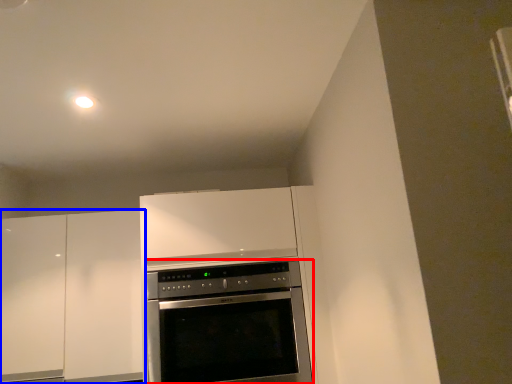
Question: Which of the following is the closest to the observer, oven (highlighted by a red box) or cabinetry (highlighted by a blue box)?

Choices:
 (A) oven
 (B) cabinetry

Answer: (A)